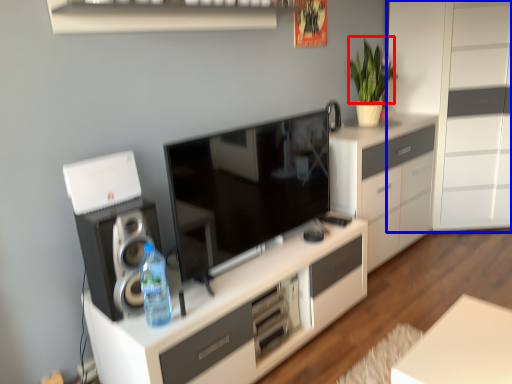
Question: Which point is further to the camera, plant (highlighted by a red box) or chest of drawers (highlighted by a blue box)?

Choices:
 (A) plant
 (B) chest of drawers

Answer: (A)